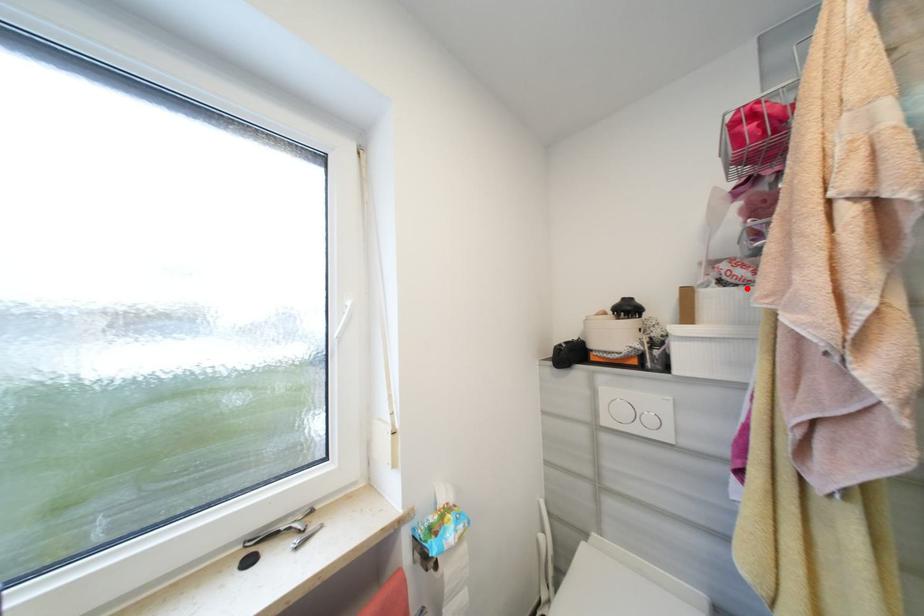
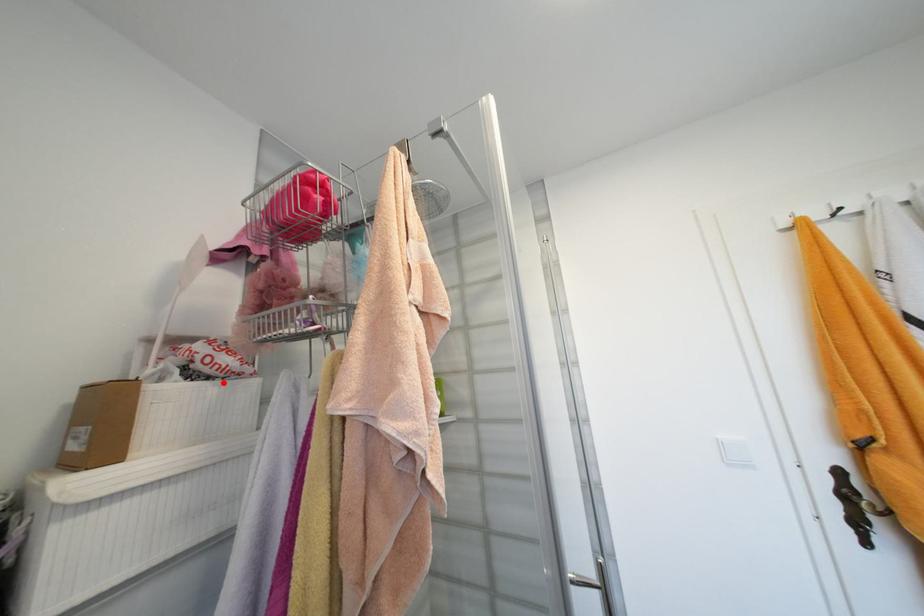
I am providing you with two images of the same scene from different viewpoints. A red point is marked on the first image and another point is marked on the second image. Do the highlighted points in image1 and image2 indicate the same real-world spot?

Yes